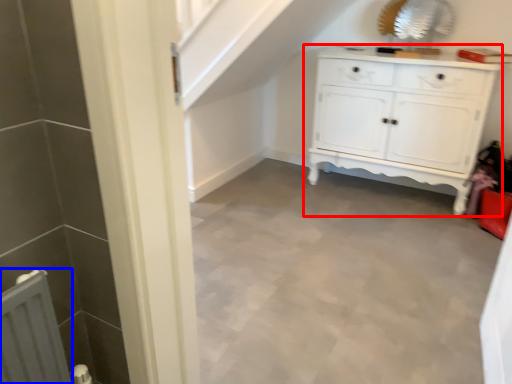
Question: Which of the following is the farthest to the observer, chest of drawers (highlighted by a red box) or radiator (highlighted by a blue box)?

Choices:
 (A) chest of drawers
 (B) radiator

Answer: (A)